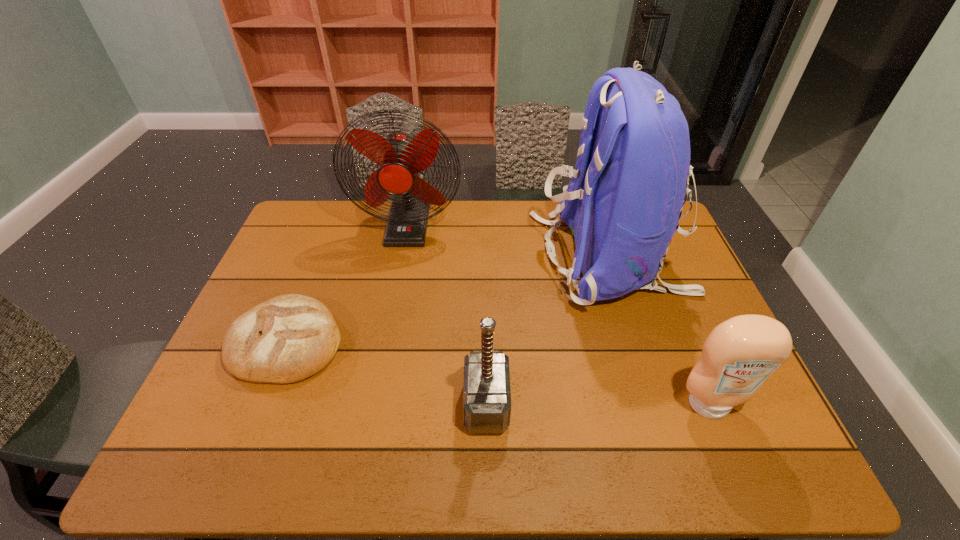
The image size is (960, 540). In order to click on the tallest object in this screenshot , I will do `click(625, 198)`.

The height and width of the screenshot is (540, 960). I want to click on fan, so [x=401, y=156].

Identify the location of hammer. (486, 390).

Find the location of `condiment`. condiment is located at coordinates click(x=738, y=356).

Where is `bread`? The width and height of the screenshot is (960, 540). bread is located at coordinates (286, 339).

The image size is (960, 540). In order to click on free spot located on the back of the tallest object in this screenshot , I will do `click(436, 258)`.

In order to click on free spot located 0.200m on the back of the tallest object in this screenshot , I will do `click(473, 258)`.

Where is `vacant space positioned 0.070m on the back of the tallest object`? The height and width of the screenshot is (540, 960). vacant space positioned 0.070m on the back of the tallest object is located at coordinates (514, 258).

What are the coordinates of `vacant area situated on the front-facing side of the fan` in the screenshot? It's located at (388, 330).

You are a GUI agent. You are given a task and a screenshot of the screen. Output one action in this format:
    pyautogui.click(x=<x>, y=<y>)
    Task: Click on the free point located 0.080m on the right of the hammer
    Image resolution: width=960 pixels, height=540 pixels.
    Given the screenshot: What is the action you would take?
    pyautogui.click(x=541, y=404)